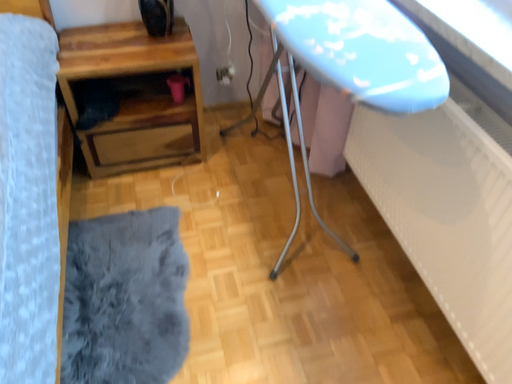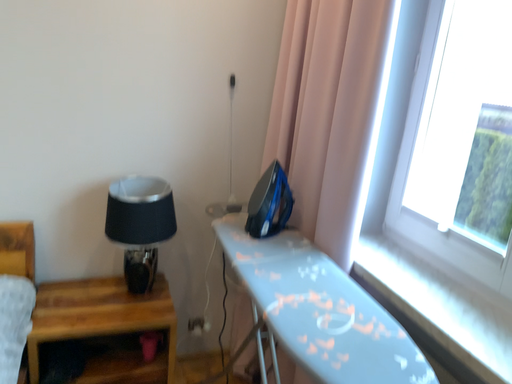
Question: How did the camera likely rotate when shooting the video?

Choices:
 (A) rotated downward
 (B) rotated upward

Answer: (B)